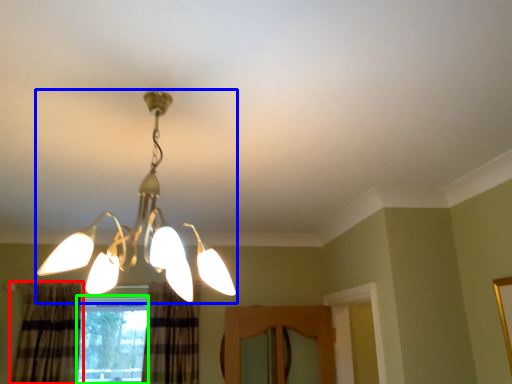
Question: Which object is the closest to the curtain (highlighted by a red box)? Choose among these: lamp (highlighted by a blue box) or window (highlighted by a green box).

Choices:
 (A) lamp
 (B) window

Answer: (B)